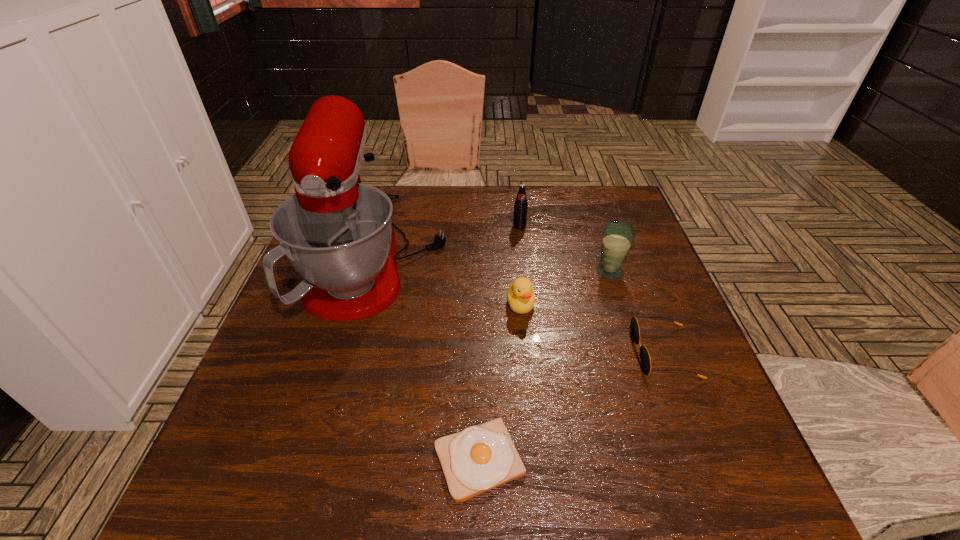
Where is `vacant position located on the left of the glass`? The width and height of the screenshot is (960, 540). vacant position located on the left of the glass is located at coordinates (465, 271).

Where is `free point located 0.150m on the face of the duckling`? This screenshot has width=960, height=540. free point located 0.150m on the face of the duckling is located at coordinates point(527,374).

Locate an element on the screen. Image resolution: width=960 pixels, height=540 pixels. vacant space located 0.200m on the front-facing side of the second shortest object is located at coordinates (540, 353).

Find the location of a particular element. The width and height of the screenshot is (960, 540). free space located 0.050m on the front-facing side of the second shortest object is located at coordinates (611, 353).

Identify the location of vacant space located on the front-facing side of the second shortest object. The width and height of the screenshot is (960, 540). (536, 353).

Find the location of a particular element. The height and width of the screenshot is (540, 960). free space located on the left of the toast is located at coordinates (371, 460).

You are a GUI agent. You are given a task and a screenshot of the screen. Output one action in this format:
    pyautogui.click(x=<x>, y=<y>)
    Task: Click on the mixer positioned at the far edge
    The height and width of the screenshot is (540, 960).
    Given the screenshot: What is the action you would take?
    pyautogui.click(x=337, y=233)

The image size is (960, 540). In order to click on pop that is at the far edge in this screenshot , I will do `click(520, 211)`.

At what (x,y) coordinates should I click in order to perform the action: click on object located in the near edge section of the desktop. Please return your answer as a coordinate pair (x, y). This screenshot has height=540, width=960. Looking at the image, I should click on (482, 457).

You are a GUI agent. You are given a task and a screenshot of the screen. Output one action in this format:
    pyautogui.click(x=<x>, y=<y>)
    Task: Click on the object present at the left edge
    
    Given the screenshot: What is the action you would take?
    pyautogui.click(x=337, y=233)